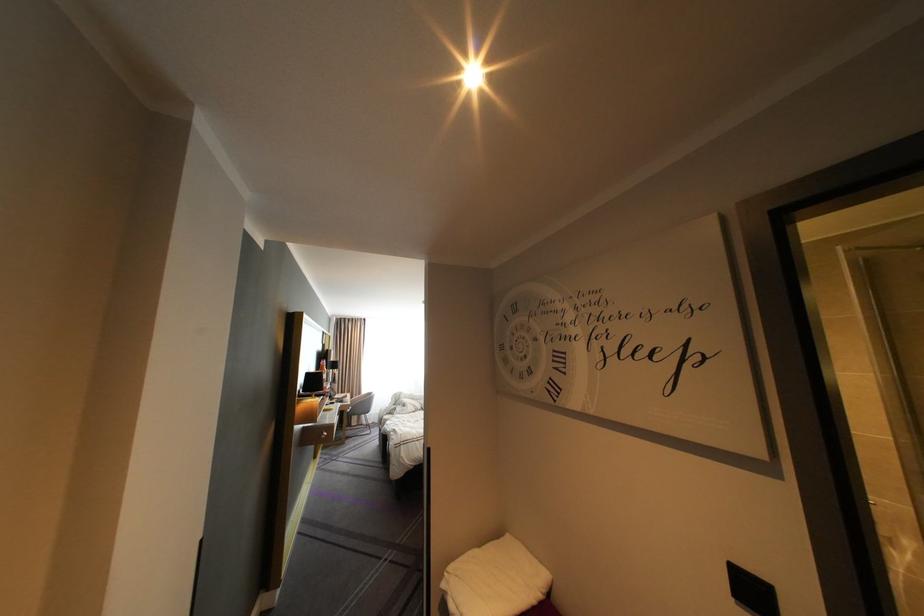
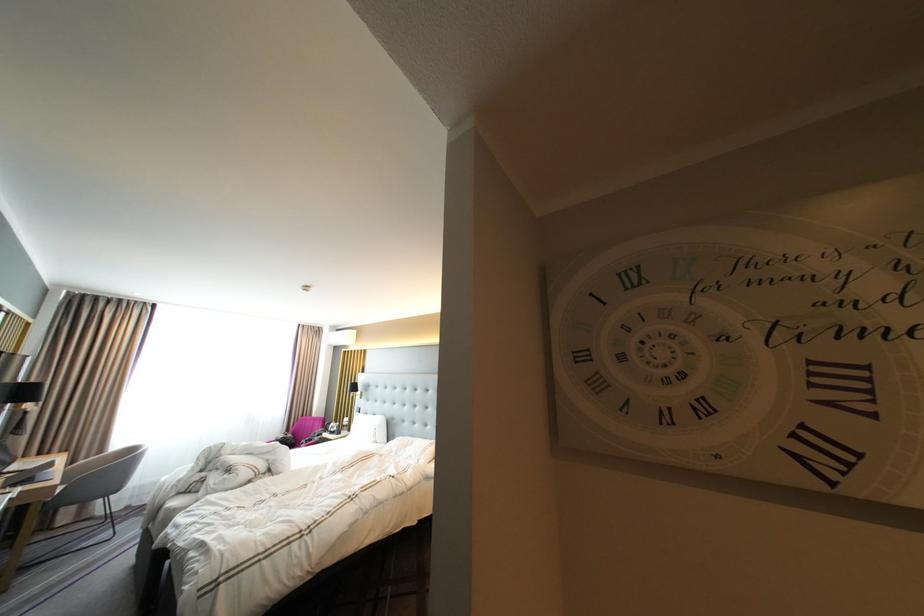
Where in the second image is the point corresponding to the point at 348,398 from the first image?

(27, 468)